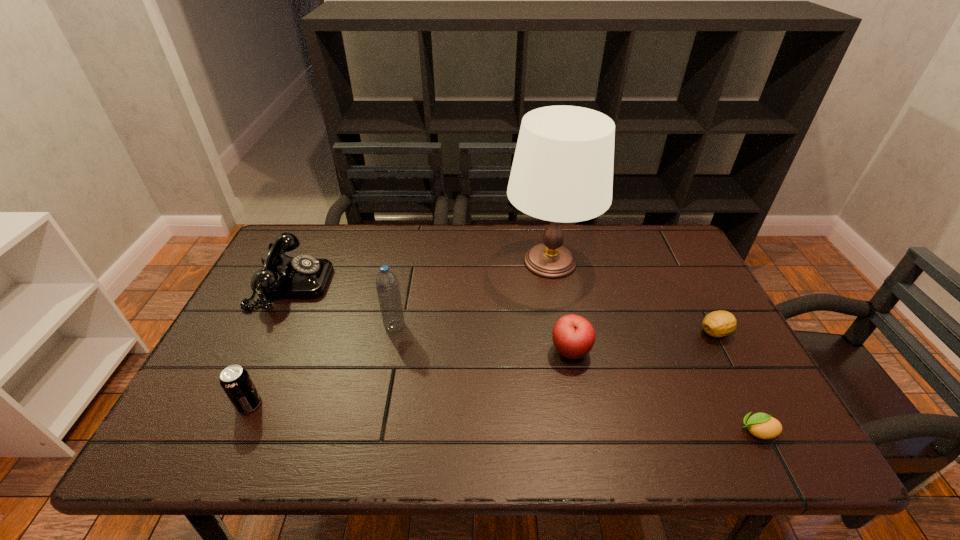
Identify the location of free space located on the left of the lamp. (459, 261).

Locate an element on the screen. vacant space located on the right of the water bottle is located at coordinates (424, 326).

Locate an element on the screen. Image resolution: width=960 pixels, height=540 pixels. vacant area situated 0.370m on the dial of the telephone is located at coordinates [x=454, y=284].

The width and height of the screenshot is (960, 540). I want to click on free space located on the right of the second nearest object, so pyautogui.click(x=341, y=404).

Where is `free space located on the left of the apple`? The height and width of the screenshot is (540, 960). free space located on the left of the apple is located at coordinates (431, 351).

I want to click on free space located at the stem end of the taller lemon, so click(588, 332).

Where is `vacant space located at the stem end of the taller lemon`? This screenshot has height=540, width=960. vacant space located at the stem end of the taller lemon is located at coordinates (607, 332).

In order to click on vacant space situated 0.160m at the stem end of the taller lemon in this screenshot , I will do `click(637, 332)`.

The height and width of the screenshot is (540, 960). I want to click on free spot located 0.300m with leaves positioned above the nearest object, so click(x=598, y=431).

I want to click on free point located with leaves positioned above the nearest object, so click(x=551, y=431).